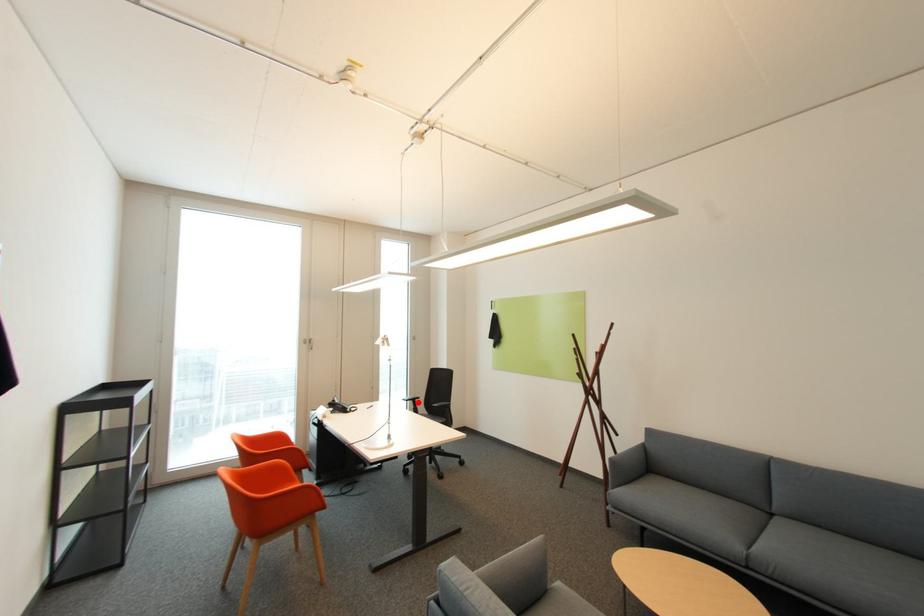
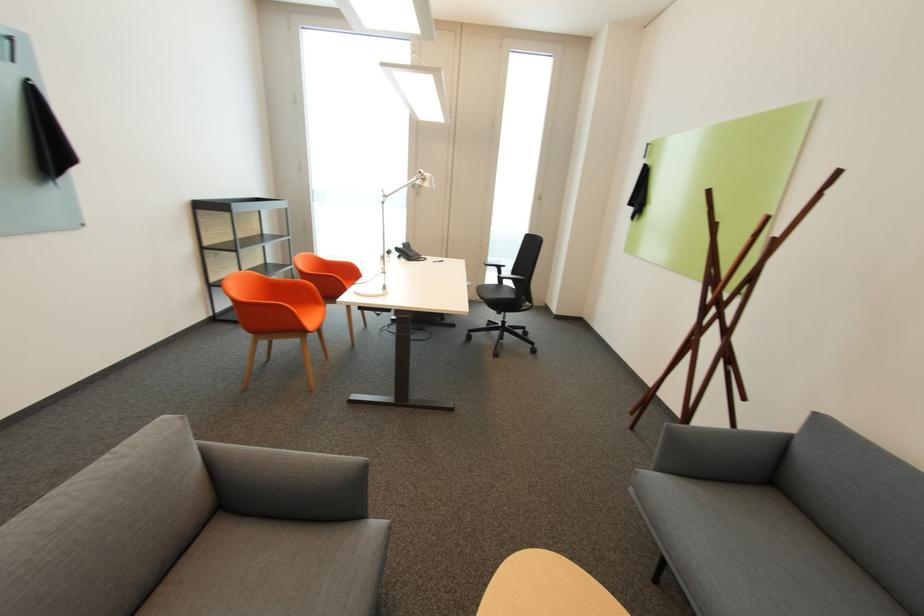
Find the pixel in the second image that matches the highlighted location in the first image.

(503, 269)